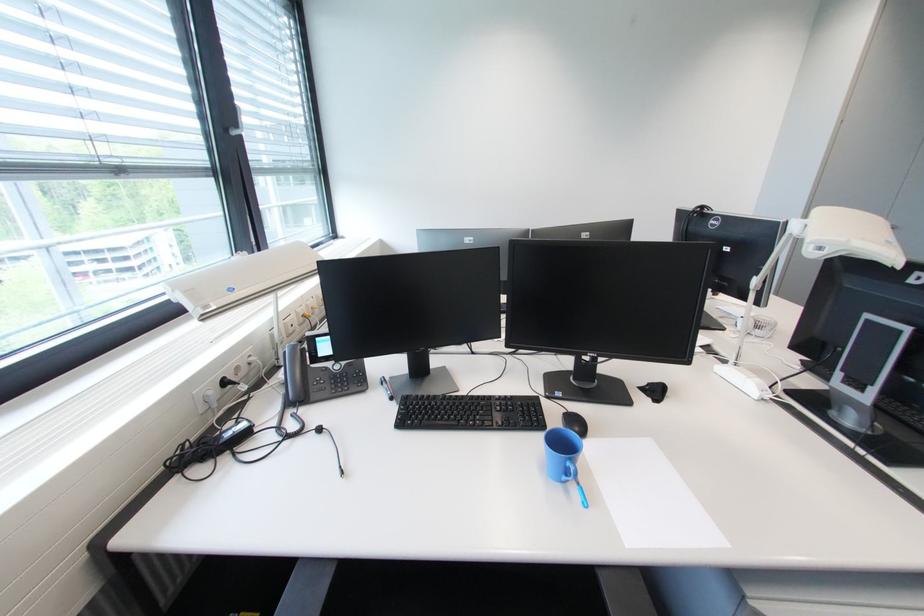
This screenshot has height=616, width=924. What do you see at coordinates (570, 471) in the screenshot?
I see `the blue mug handle` at bounding box center [570, 471].